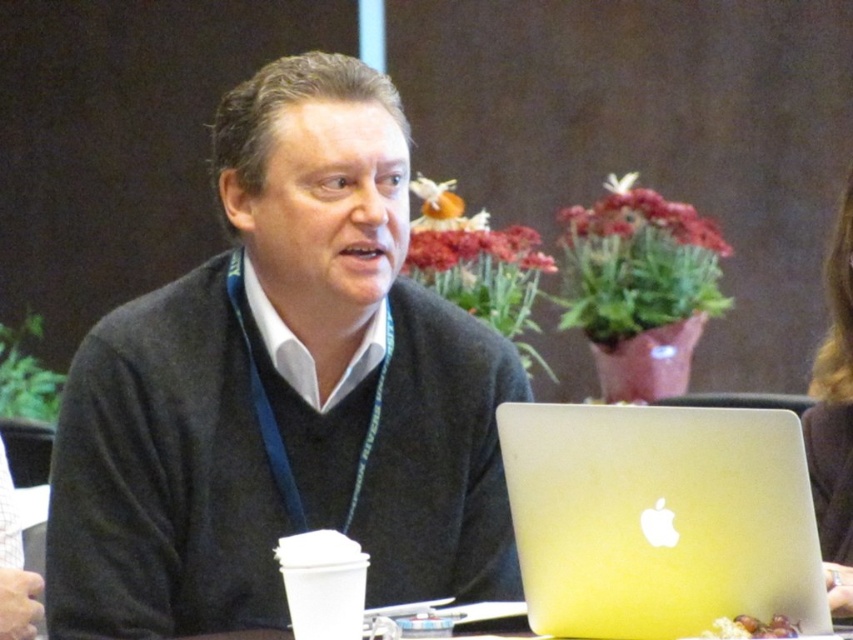
Based on the scene description, is the silver metallic laptop at center positioned closer to the viewer than the dark brown hair at upper right?

Yes, the silver metallic laptop at center is in front of dark brown hair at upper right, meaning it is closer to the viewer.

Based on the scene described, which object at the center of the table is bigger, the dark gray sweater at center or the silver metallic laptop at center?

The dark gray sweater at center is larger in size than the silver metallic laptop at center.